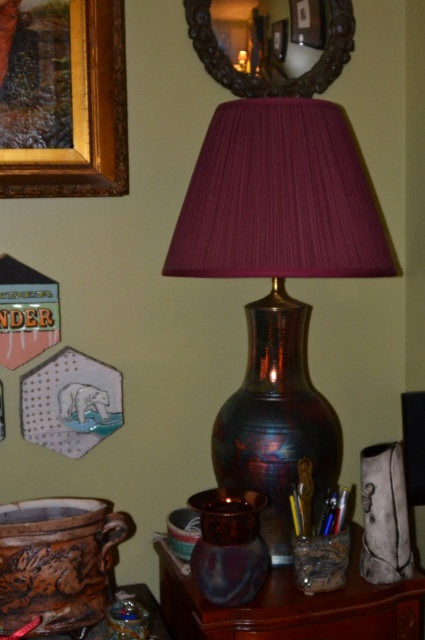
Question: Which of the following is the farthest from the observer?

Choices:
 (A) (224, 72)
 (B) (286, 296)

Answer: (A)

Question: Which of the following is the closest to the observer?

Choices:
 (A) (272, 378)
 (B) (316, 608)

Answer: (B)

Question: Can you confirm if wooden frame mirror at upper center is wider than brown wood drawer at lower center?

Choices:
 (A) yes
 (B) no

Answer: (A)

Question: Which of the following is the farthest from the observer?

Choices:
 (A) (232, 568)
 (B) (373, 627)

Answer: (B)

Question: Is translucent glass vase at lower center bigger than shiny purple vase at center?

Choices:
 (A) yes
 (B) no

Answer: (A)

Question: Does translucent glass vase at lower center have a greater width compared to brown wood drawer at lower center?

Choices:
 (A) yes
 (B) no

Answer: (A)